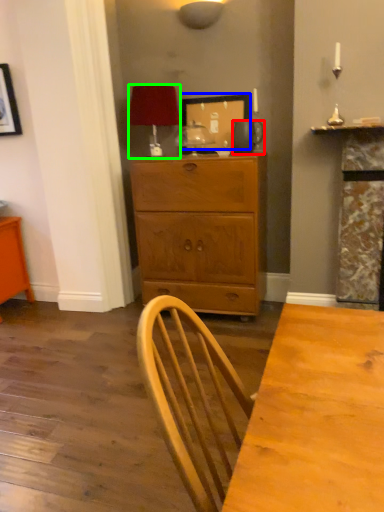
Question: Considering the real-world distances, which object is farthest from pitcher (highlighted by a red box)? picture frame (highlighted by a blue box) or lamp (highlighted by a green box)?

Choices:
 (A) picture frame
 (B) lamp

Answer: (B)